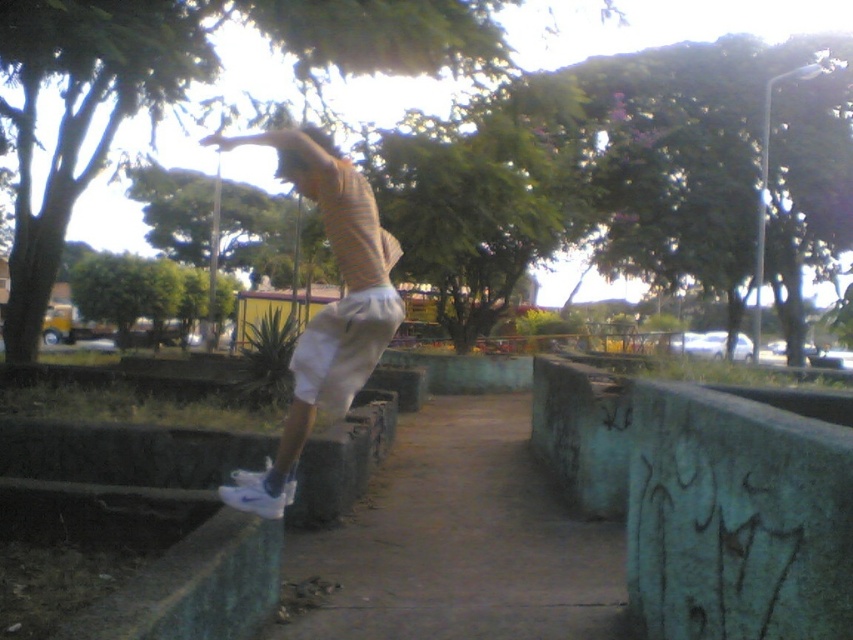
Which is in front, point (387, 570) or point (339, 339)?

Positioned in front is point (339, 339).

Based on the photo, can you confirm if green concrete pavement at center is positioned to the left of white matte sneakers at center?

No, green concrete pavement at center is not to the left of white matte sneakers at center.

Which is behind, point (577, 538) or point (380, 339)?

The point (577, 538) is more distant.

Where is `green concrete pavement at center`? green concrete pavement at center is located at coordinates (460, 541).